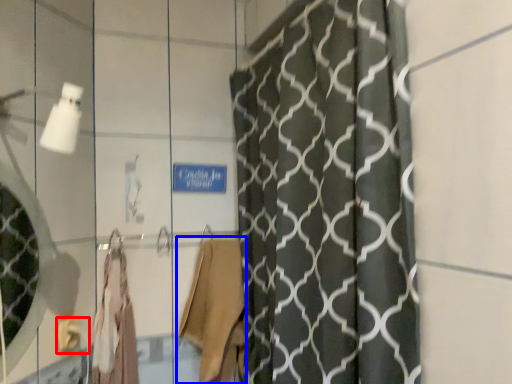
Question: Which object appears closest to the camera in this image, towel bar (highlighted by a red box) or robe (highlighted by a blue box)?

Choices:
 (A) towel bar
 (B) robe

Answer: (A)